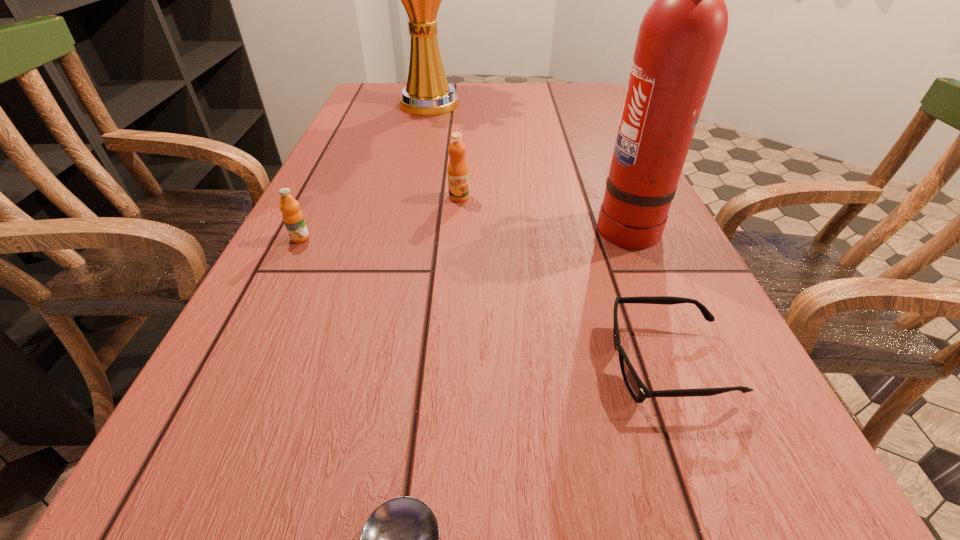
Identify the location of unoccupied position between the left orange juice and the fifth nearest object. (379, 218).

You are a GUI agent. You are given a task and a screenshot of the screen. Output one action in this format:
    pyautogui.click(x=<x>, y=<y>)
    Task: Click on the vacant point located between the trophy_cup and the fifth nearest object
    This screenshot has height=540, width=960.
    Given the screenshot: What is the action you would take?
    pyautogui.click(x=444, y=151)

Identify the location of free space between the nearer orange juice and the sunglasses. (484, 301).

Identify the location of blank region between the farthest object and the fourth shortest object. (444, 151).

I want to click on object that stands as the fourth closest to the fire extinguisher, so click(400, 539).

You are a GUI agent. You are given a task and a screenshot of the screen. Output one action in this format:
    pyautogui.click(x=<x>, y=<y>)
    Task: Click on the object that is the fourth closest one to the fifth nearest object
    
    Given the screenshot: What is the action you would take?
    pyautogui.click(x=639, y=392)